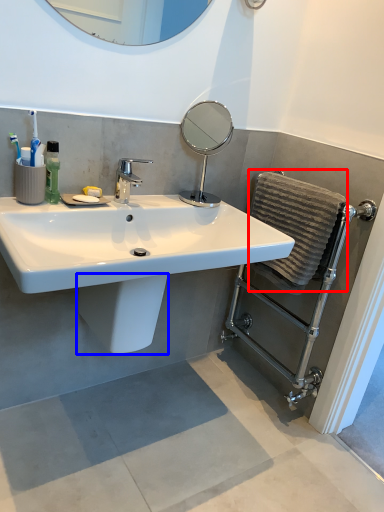
Question: Which of the following is the farthest to the observer, bath towel (highlighted by a red box) or bidet (highlighted by a blue box)?

Choices:
 (A) bath towel
 (B) bidet

Answer: (A)